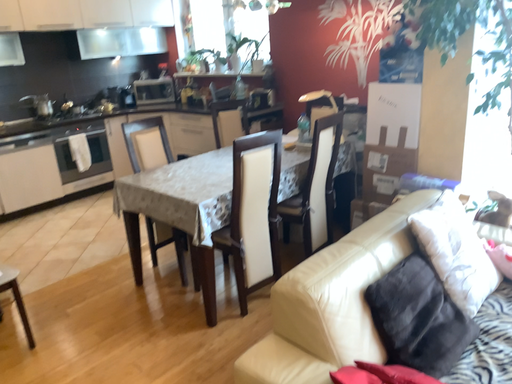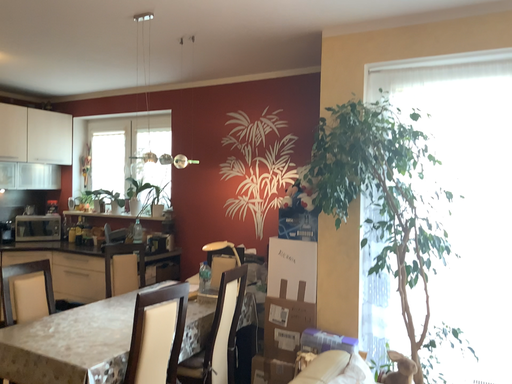
Question: How did the camera likely rotate when shooting the video?

Choices:
 (A) rotated right
 (B) rotated left

Answer: (A)